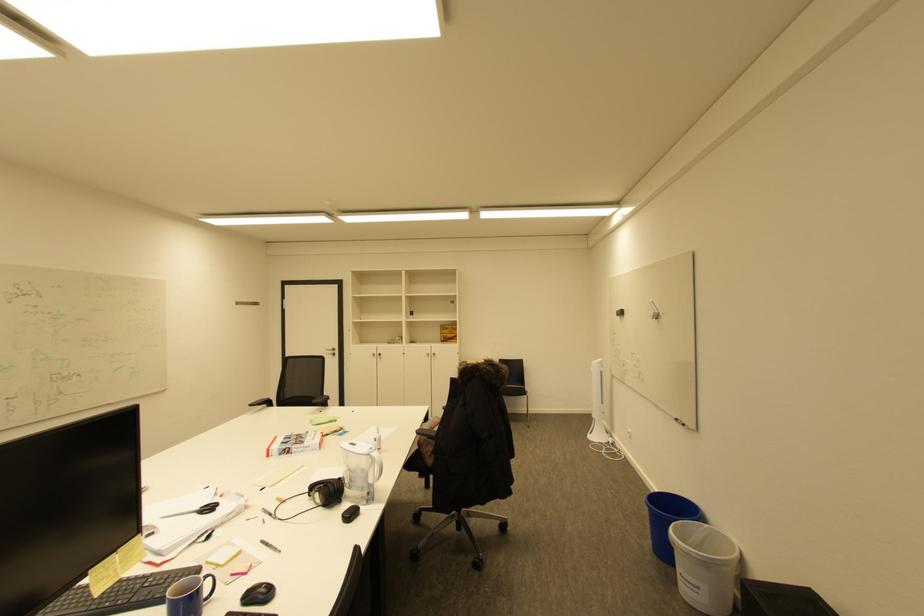
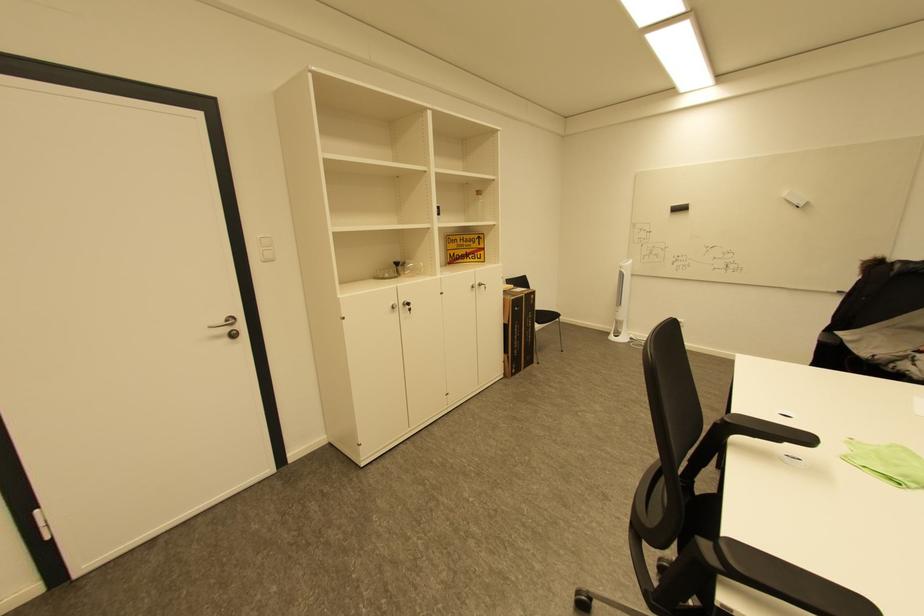
The point at [434,355] is marked in the first image. Where is the corresponding point in the second image?

(479, 286)